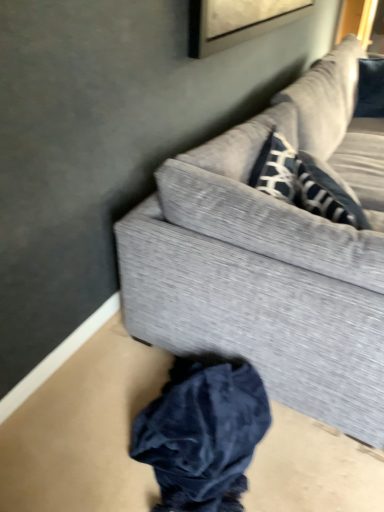
Question: Is textured gray couch at upper right situated inside dark blue velvet clothing at lower center or outside?

Choices:
 (A) outside
 (B) inside

Answer: (A)

Question: Is point (122, 227) positioned closer to the camera than point (215, 442)?

Choices:
 (A) closer
 (B) farther

Answer: (B)

Question: Looking at the image, does textured gray couch at upper right seem bigger or smaller compared to dark blue velvet clothing at lower center?

Choices:
 (A) small
 (B) big

Answer: (B)

Question: Is dark blue velvet clothing at lower center taller or shorter than textured gray couch at upper right?

Choices:
 (A) short
 (B) tall

Answer: (A)

Question: Visually, is dark blue velvet clothing at lower center positioned to the left or to the right of textured gray couch at upper right?

Choices:
 (A) right
 (B) left

Answer: (B)

Question: Does point (175, 400) appear closer or farther from the camera than point (382, 172)?

Choices:
 (A) farther
 (B) closer

Answer: (B)

Question: From the image's perspective, is dark blue velvet clothing at lower center located above or below textured gray couch at upper right?

Choices:
 (A) below
 (B) above

Answer: (A)